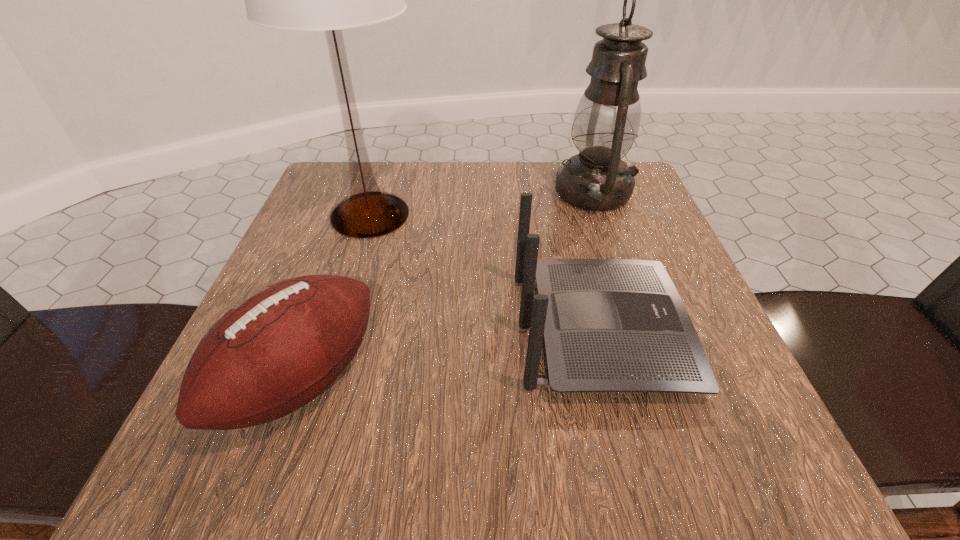
Find the location of a particular element. The image size is (960, 540). table lamp that is positioned at the left edge is located at coordinates (329, 0).

Identify the location of football (American) present at the left edge. This screenshot has height=540, width=960. (276, 350).

You are a GUI agent. You are given a task and a screenshot of the screen. Output one action in this format:
    pyautogui.click(x=<x>, y=<y>)
    Task: Click on the oil lamp that is at the right edge
    This screenshot has height=540, width=960.
    Given the screenshot: What is the action you would take?
    pyautogui.click(x=606, y=122)

Where is `router present at the right edge`? router present at the right edge is located at coordinates (610, 325).

Identify the location of object at the far left corner. (329, 0).

The width and height of the screenshot is (960, 540). Find the location of `object that is positioned at the near left corner`. object that is positioned at the near left corner is located at coordinates (276, 350).

This screenshot has height=540, width=960. Find the location of `object present at the far right corner`. object present at the far right corner is located at coordinates (606, 122).

Where is `vacant space at the far edge`? Image resolution: width=960 pixels, height=540 pixels. vacant space at the far edge is located at coordinates (542, 194).

Locate an element on the screen. Image resolution: width=960 pixels, height=540 pixels. free region at the near edge of the desktop is located at coordinates (641, 472).

Locate an element on the screen. The image size is (960, 540). vacant region at the right edge of the desktop is located at coordinates (688, 298).